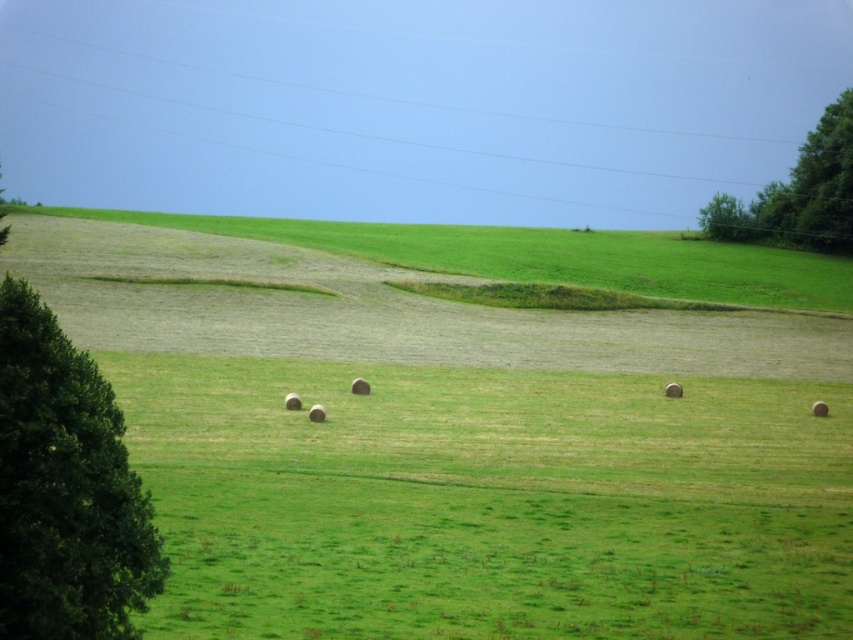
You are standing in the middle of the green grass at center and want to walk towards the green leafy tree at left. Which direction should you head?

The green grass at center is positioned on the right side of green leafy tree at left, so you should head to the left to reach the green leafy tree at left.

You are a landscape architect designing a new park layout. You need to place a bench between the green leafy tree at left and the green leafy tree at upper right. Considering their widths, which tree should the bench be closer to and why?

The bench should be closer to the green leafy tree at left because its width is smaller than the green leafy tree at upper right, allowing for better spatial balance in the park layout.